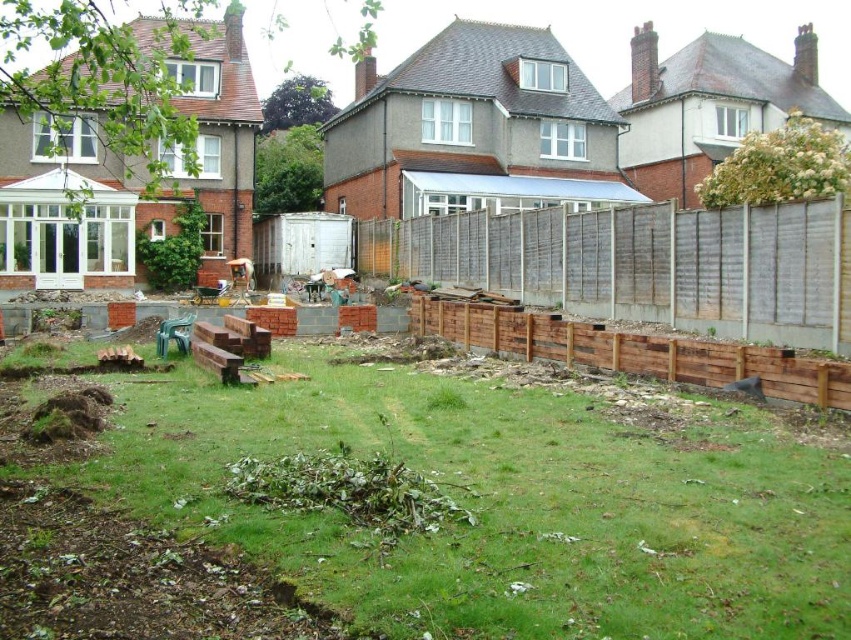
You are a gardener who needs to place a new flower pot between the green grass at center and the brown wooden fence at center. According to the scene description, which object should the flower pot be closer to?

The flower pot should be placed closer to the brown wooden fence at center because the green grass at center is positioned on the left side of the brown wooden fence at center, meaning the fence is to the right of the grass. Therefore, placing the flower pot near the fence would maintain the spatial arrangement.

You are a gardener assessing the backyard. You notice the green grass at center and the brown wooden fence at center. Which object is shorter in height?

The green grass at center is not as tall as the brown wooden fence at center, so the green grass at center is shorter in height.

You are standing in the backyard and want to place a small garden statue between the green grass at center and the brown wooden fence at center. Based on their positions, which object should the statue be closer to?

The green grass at center is in front of the brown wooden fence at center, so the statue should be placed closer to the brown wooden fence at center to ensure it is between them.